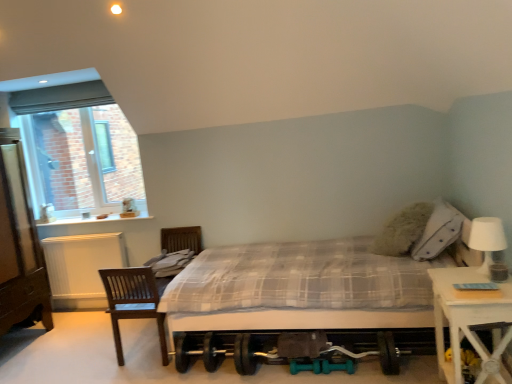
Question: In terms of width, does white matte table lamp at right look wider or thinner when compared to white plastic window at upper left?

Choices:
 (A) thin
 (B) wide

Answer: (B)

Question: From the image's perspective, is white matte table lamp at right positioned above or below white plastic window at upper left?

Choices:
 (A) above
 (B) below

Answer: (B)

Question: Which of these objects is positioned farthest from the white plastic window at upper left?

Choices:
 (A) plaid fabric bed at center
 (B) white textured radiator at left
 (C) white wood nightstand at right
 (D) brown wooden dresser at left
 (E) white matte table lamp at right

Answer: (E)

Question: Which of these objects is positioned farthest from the plaid fabric bed at center?

Choices:
 (A) white textured radiator at left
 (B) brown wooden dresser at left
 (C) white matte table lamp at right
 (D) white wood nightstand at right
 (E) white plastic window at upper left

Answer: (E)